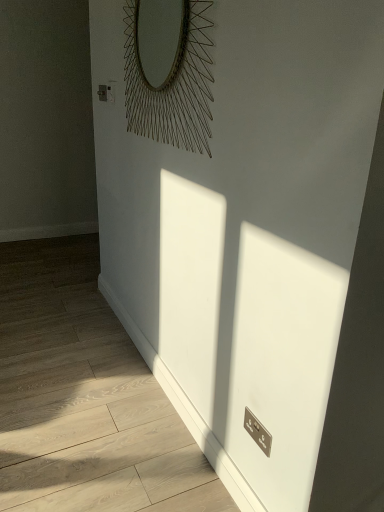
Question: Should I look upward or downward to see metallic wire at upper center?

Choices:
 (A) down
 (B) up

Answer: (B)

Question: Is white glossy radiator at lower right a part of metallic wire at upper center?

Choices:
 (A) no
 (B) yes

Answer: (A)

Question: Is metallic wire at upper center oriented towards white glossy radiator at lower right?

Choices:
 (A) yes
 (B) no

Answer: (B)

Question: From the image's perspective, is metallic wire at upper center on white glossy radiator at lower right?

Choices:
 (A) no
 (B) yes

Answer: (B)

Question: Would you say metallic wire at upper center is outside white glossy radiator at lower right?

Choices:
 (A) no
 (B) yes

Answer: (B)

Question: From a real-world perspective, does metallic wire at upper center sit lower than white glossy radiator at lower right?

Choices:
 (A) yes
 (B) no

Answer: (B)

Question: Considering the relative sizes of metallic wire at upper center and white glossy radiator at lower right in the image provided, is metallic wire at upper center smaller than white glossy radiator at lower right?

Choices:
 (A) yes
 (B) no

Answer: (A)

Question: Considering the relative sizes of white glossy radiator at lower right and metallic wire at upper center in the image provided, is white glossy radiator at lower right taller than metallic wire at upper center?

Choices:
 (A) no
 (B) yes

Answer: (A)

Question: Considering the relative positions of white glossy radiator at lower right and metallic wire at upper center in the image provided, is white glossy radiator at lower right to the right of metallic wire at upper center from the viewer's perspective?

Choices:
 (A) yes
 (B) no

Answer: (B)

Question: Is white glossy radiator at lower right facing away from metallic wire at upper center?

Choices:
 (A) no
 (B) yes

Answer: (A)

Question: Is metallic wire at upper center a part of white glossy radiator at lower right?

Choices:
 (A) no
 (B) yes

Answer: (A)

Question: Is white glossy radiator at lower right to the left of metallic wire at upper center from the viewer's perspective?

Choices:
 (A) yes
 (B) no

Answer: (A)

Question: Can you confirm if white glossy radiator at lower right is smaller than metallic wire at upper center?

Choices:
 (A) yes
 (B) no

Answer: (B)

Question: Which is correct: white glossy radiator at lower right is inside metallic wire at upper center, or outside of it?

Choices:
 (A) inside
 (B) outside

Answer: (B)